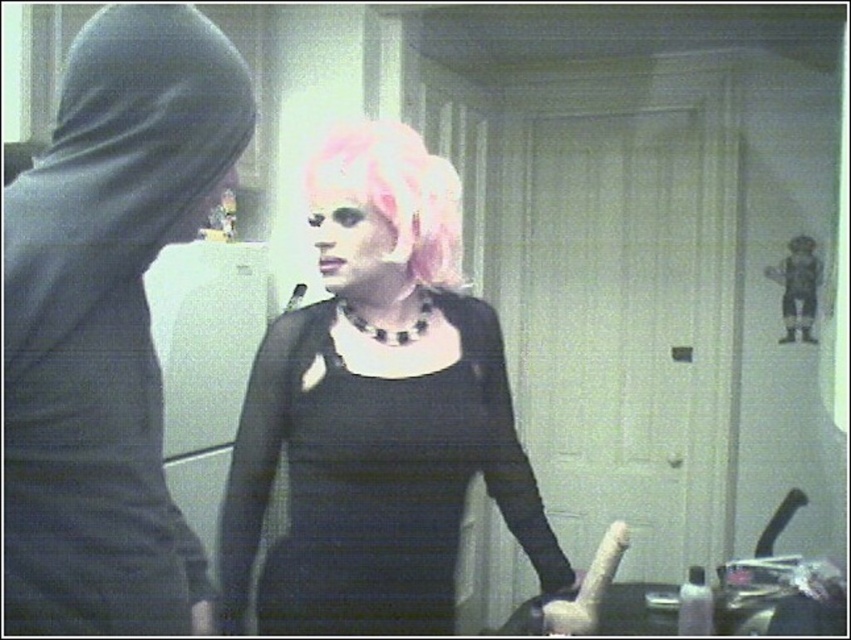
You are a GUI agent. You are given a task and a screenshot of the screen. Output one action in this format:
    pyautogui.click(x=<x>, y=<y>)
    Task: Click on the black matte hoodie at left
    
    Given the screenshot: What is the action you would take?
    pos(107,323)

Identify the location of black matte hoodie at left. (107, 323).

The image size is (851, 640). Describe the element at coordinates (375, 412) in the screenshot. I see `matte black dress at center` at that location.

Does matte black dress at center have a greater width compared to matte plastic bottle at lower right?

Correct, the width of matte black dress at center exceeds that of matte plastic bottle at lower right.

The width and height of the screenshot is (851, 640). I want to click on matte black dress at center, so click(375, 412).

Which is in front, point (360, 131) or point (697, 600)?

Point (360, 131) is more forward.

Can you confirm if pink synthetic wig at center is taller than matte plastic bottle at lower right?

Correct, pink synthetic wig at center is much taller as matte plastic bottle at lower right.

The height and width of the screenshot is (640, 851). Find the location of `pink synthetic wig at center`. pink synthetic wig at center is located at coordinates (397, 193).

Locate an element on the screen. pink synthetic wig at center is located at coordinates (x=397, y=193).